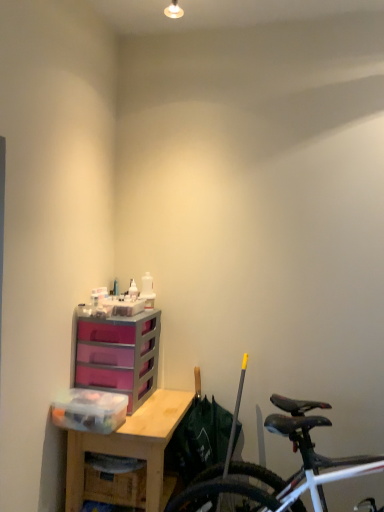
What do you see at coordinates (117, 355) in the screenshot? I see `purple plastic chest of drawers at center` at bounding box center [117, 355].

Locate an element on the screen. The image size is (384, 512). transparent plastic storage box at left is located at coordinates (90, 410).

Identify the location of purple plastic chest of drawers at center. The width and height of the screenshot is (384, 512). (117, 355).

Measure the distance between wooden desk at center and purple plastic chest of drawers at center.

wooden desk at center and purple plastic chest of drawers at center are 10.82 inches apart.

Considering their positions, is wooden desk at center located in front of or behind purple plastic chest of drawers at center?

Clearly, wooden desk at center is in front of purple plastic chest of drawers at center.

Is point (109, 435) in front of point (130, 393)?

Yes, point (109, 435) is in front of point (130, 393).

Looking at this image, is purple plastic chest of drawers at center at the back of wooden desk at center?

No, wooden desk at center is not facing away from purple plastic chest of drawers at center.

Which of these two, shiny black bicycle at lower right or transparent plastic storage box at left, is thinner?

Thinner between the two is transparent plastic storage box at left.

Where is `storage box above the shiny black bicycle at lower right (from a real-world perspective)`? storage box above the shiny black bicycle at lower right (from a real-world perspective) is located at coordinates (90, 410).

Would you say shiny black bicycle at lower right is outside transparent plastic storage box at left?

Yes, shiny black bicycle at lower right is not within transparent plastic storage box at left.

From a real-world perspective, is shiny black bicycle at lower right physically above transparent plastic storage box at left?

No, from a real-world perspective, shiny black bicycle at lower right is not on top of transparent plastic storage box at left.

From the image's perspective, is purple plastic chest of drawers at center above or below wooden desk at center?

purple plastic chest of drawers at center is above wooden desk at center.

From a real-world perspective, is purple plastic chest of drawers at center located higher than wooden desk at center?

Yes.

In the scene shown: Between purple plastic chest of drawers at center and wooden desk at center, which one appears on the right side from the viewer's perspective?

From the viewer's perspective, wooden desk at center appears more on the right side.

Is transparent plastic storage box at left located within wooden desk at center?

No, wooden desk at center does not contain transparent plastic storage box at left.

From a real-world perspective, who is located higher, wooden desk at center or transparent plastic storage box at left?

transparent plastic storage box at left, from a real-world perspective.

Which point is more distant from viewer, (125, 435) or (99, 396)?

Positioned behind is point (99, 396).

Does wooden desk at center have a lesser height compared to transparent plastic storage box at left?

In fact, wooden desk at center may be taller than transparent plastic storage box at left.

In the image, is purple plastic chest of drawers at center positioned in front of or behind shiny black bicycle at lower right?

purple plastic chest of drawers at center is behind shiny black bicycle at lower right.

Could you measure the distance between purple plastic chest of drawers at center and shiny black bicycle at lower right?

purple plastic chest of drawers at center is 29.29 inches from shiny black bicycle at lower right.

Could you tell me if purple plastic chest of drawers at center is facing shiny black bicycle at lower right?

No, purple plastic chest of drawers at center is not oriented towards shiny black bicycle at lower right.

Who is smaller, wooden desk at center or shiny black bicycle at lower right?

Smaller between the two is wooden desk at center.

The height and width of the screenshot is (512, 384). I want to click on desk that appears behind the shiny black bicycle at lower right, so click(130, 444).

In the scene shown: From the image's perspective, which object appears higher, wooden desk at center or shiny black bicycle at lower right?

shiny black bicycle at lower right appears higher in the image.

From a real-world perspective, is wooden desk at center positioned above or below shiny black bicycle at lower right?

wooden desk at center is situated lower than shiny black bicycle at lower right in the real world.

Can you tell me how much transparent plastic storage box at left and wooden desk at center differ in facing direction?

transparent plastic storage box at left and wooden desk at center are facing 1.09 degrees away from each other.

From the image's perspective, which is below, transparent plastic storage box at left or wooden desk at center?

wooden desk at center is shown below in the image.

Is transparent plastic storage box at left at the right side of wooden desk at center?

Incorrect, transparent plastic storage box at left is not on the right side of wooden desk at center.

Does transparent plastic storage box at left have a smaller size compared to wooden desk at center?

Correct, transparent plastic storage box at left occupies less space than wooden desk at center.

Find the location of a particular element. The height and width of the screenshot is (512, 384). chest of drawers on the left of wooden desk at center is located at coordinates (117, 355).

Identify the location of storage box above the shiny black bicycle at lower right (from the image's perspective). The image size is (384, 512). (90, 410).

Looking at the image, which one is located closer to shiny black bicycle at lower right, purple plastic chest of drawers at center or transparent plastic storage box at left?

Among the two, transparent plastic storage box at left is located nearer to shiny black bicycle at lower right.

Considering their positions, is purple plastic chest of drawers at center positioned further to shiny black bicycle at lower right than wooden desk at center?

purple plastic chest of drawers at center is positioned further to the anchor shiny black bicycle at lower right.

Consider the image. Looking at the image, which one is located further to transparent plastic storage box at left, purple plastic chest of drawers at center or wooden desk at center?

purple plastic chest of drawers at center is further to transparent plastic storage box at left.

From the image, which object appears to be farther from shiny black bicycle at lower right, transparent plastic storage box at left or purple plastic chest of drawers at center?

The object further to shiny black bicycle at lower right is purple plastic chest of drawers at center.

Based on their spatial positions, is wooden desk at center or transparent plastic storage box at left further from purple plastic chest of drawers at center?

The object further to purple plastic chest of drawers at center is wooden desk at center.

Considering their positions, is purple plastic chest of drawers at center positioned closer to wooden desk at center than transparent plastic storage box at left?

transparent plastic storage box at left.

Based on their spatial positions, is transparent plastic storage box at left or wooden desk at center further from purple plastic chest of drawers at center?

wooden desk at center is positioned further to the anchor purple plastic chest of drawers at center.

Looking at the image, which one is located closer to wooden desk at center, transparent plastic storage box at left or shiny black bicycle at lower right?

transparent plastic storage box at left lies closer to wooden desk at center than the other object.

Where is `storage box that lies between purple plastic chest of drawers at center and wooden desk at center from top to bottom`? storage box that lies between purple plastic chest of drawers at center and wooden desk at center from top to bottom is located at coordinates (90, 410).

This screenshot has height=512, width=384. Identify the location of desk between purple plastic chest of drawers at center and shiny black bicycle at lower right in the horizontal direction. (130, 444).

Identify the location of chest of drawers between transparent plastic storage box at left and shiny black bicycle at lower right. The width and height of the screenshot is (384, 512). (117, 355).

The image size is (384, 512). What are the coordinates of `desk situated between transparent plastic storage box at left and shiny black bicycle at lower right from left to right` in the screenshot? It's located at (130, 444).